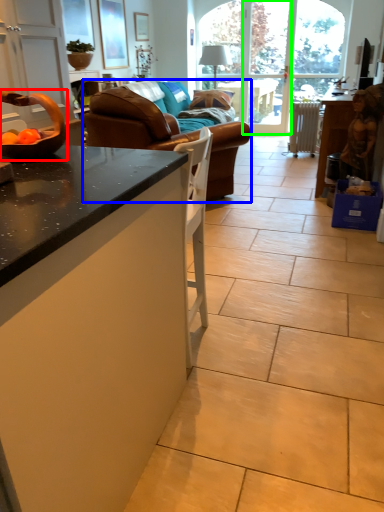
Question: Which object is positioned farthest from bowl (highlighted by a red box)? Select from studio couch (highlighted by a blue box) and screen door (highlighted by a green box).

Choices:
 (A) studio couch
 (B) screen door

Answer: (B)